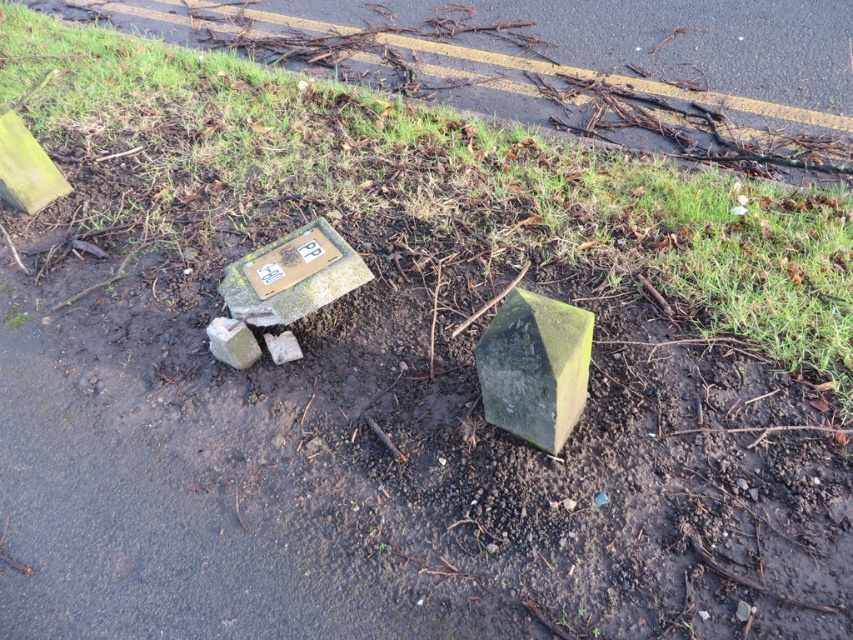
Is point (825, 236) behind point (489, 390)?

That is True.

Describe the element at coordinates (445, 179) in the screenshot. I see `green grass at upper center` at that location.

Is point (74, 184) less distant than point (483, 356)?

No, it is not.

Where is `green grass at upper center`? The height and width of the screenshot is (640, 853). green grass at upper center is located at coordinates (445, 179).